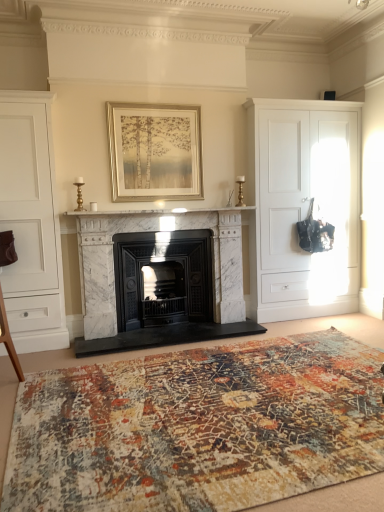
Where is `vacant area on top of gold metallic picture frame at upper center (from a real-world perspective)`? The height and width of the screenshot is (512, 384). vacant area on top of gold metallic picture frame at upper center (from a real-world perspective) is located at coordinates (153, 102).